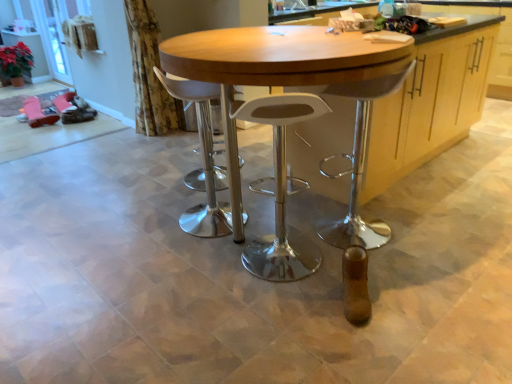
Find the location of `free location to the left of white plastic stool at center, the second stool from the left`. free location to the left of white plastic stool at center, the second stool from the left is located at coordinates 208,268.